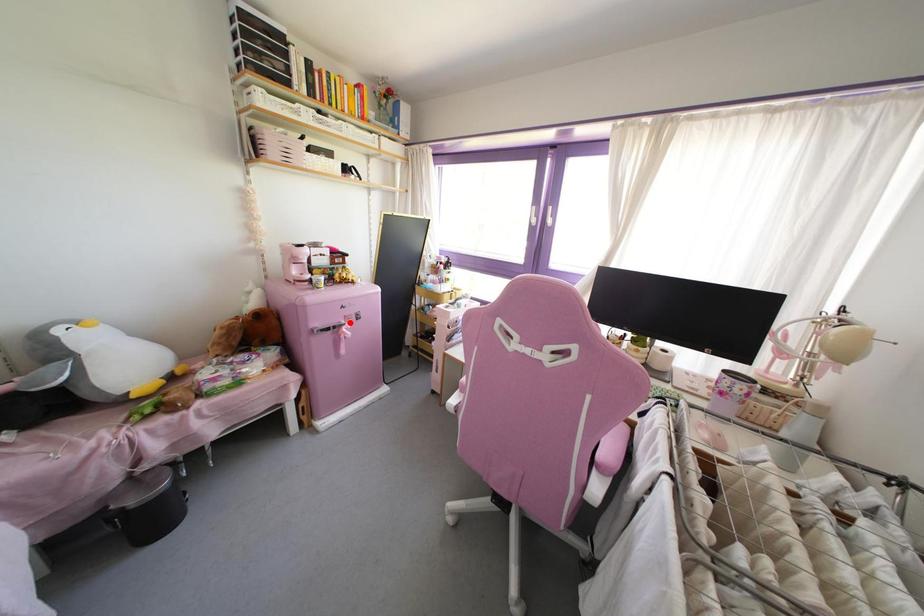
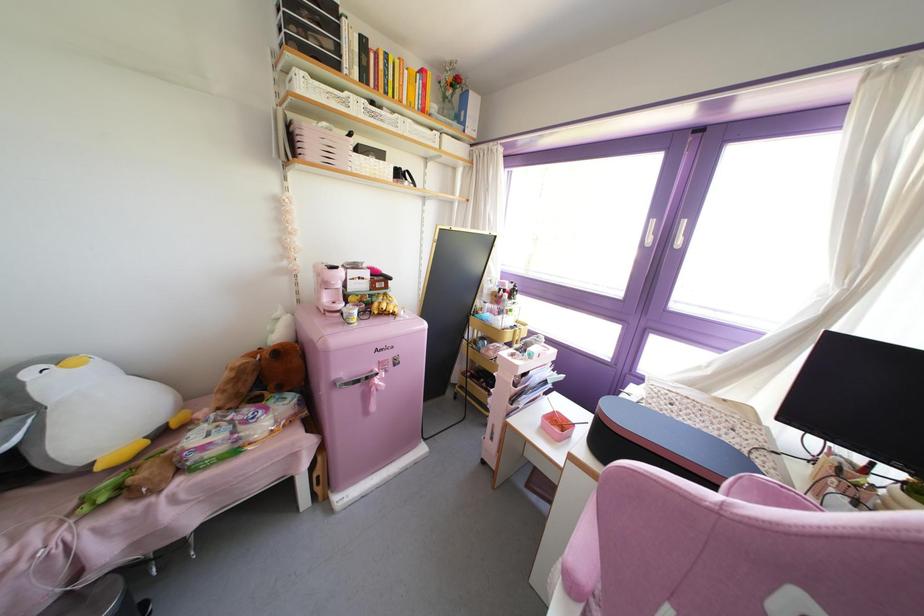
Question: I am providing you with two images of the same scene from different viewpoints. A red point is marked on the first image. At the location where the point appears in image 1, is it still visible in image 2?

Choices:
 (A) Yes
 (B) No

Answer: (A)